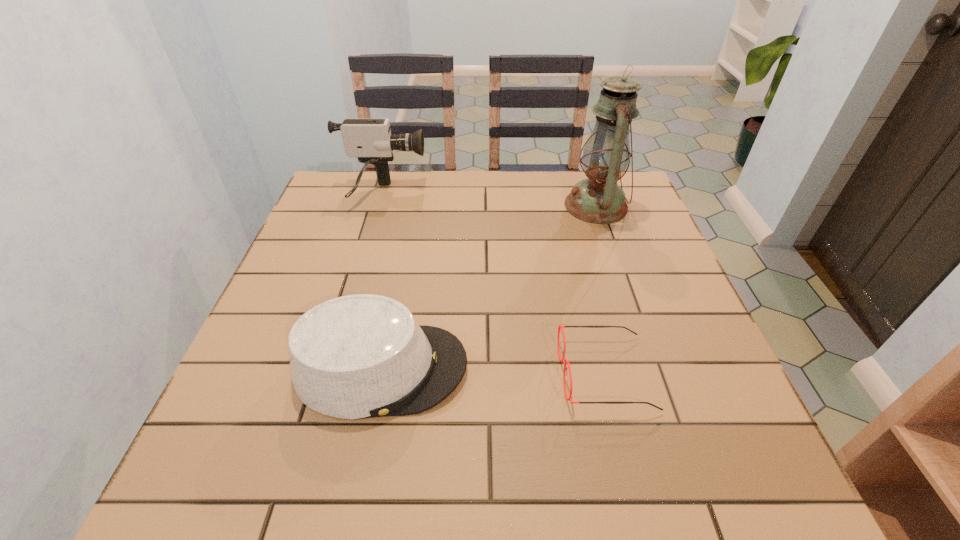
This screenshot has width=960, height=540. I want to click on oil lamp present at the far edge, so click(598, 199).

I want to click on camcorder present at the far edge, so click(x=370, y=140).

I want to click on camcorder that is at the left edge, so click(x=370, y=140).

Find the location of a particular element. This screenshot has height=540, width=960. hat that is at the left edge is located at coordinates (359, 356).

At what (x,y) coordinates should I click in order to perform the action: click on oil lamp situated at the right edge. Please return your answer as a coordinate pair (x, y). The height and width of the screenshot is (540, 960). Looking at the image, I should click on (598, 199).

Image resolution: width=960 pixels, height=540 pixels. I want to click on spectacles positioned at the right edge, so click(x=562, y=360).

This screenshot has height=540, width=960. I want to click on object that is at the far left corner, so click(x=370, y=140).

What are the coordinates of `object that is at the far right corner` in the screenshot? It's located at (598, 199).

Find the location of `free point at the far edge`. free point at the far edge is located at coordinates (532, 179).

In order to click on vacant area at the near edge of the desktop in this screenshot , I will do `click(375, 478)`.